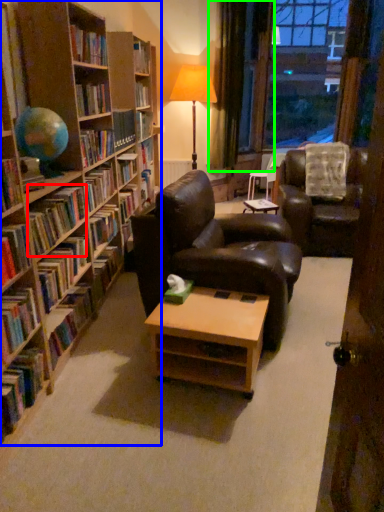
Question: Which object is the closest to the book (highlighted by a red box)? Choose among these: book (highlighted by a blue box) or curtain (highlighted by a green box).

Choices:
 (A) book
 (B) curtain

Answer: (A)